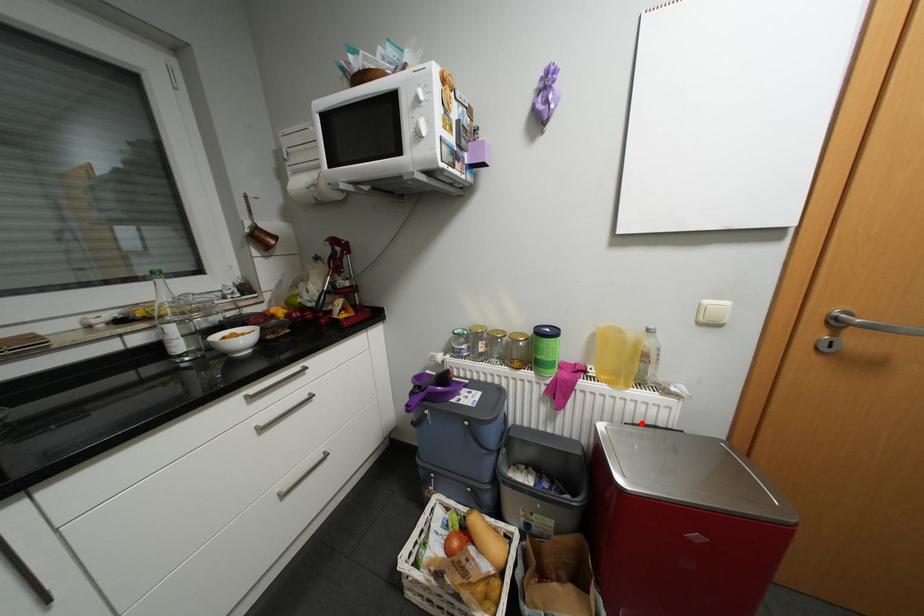
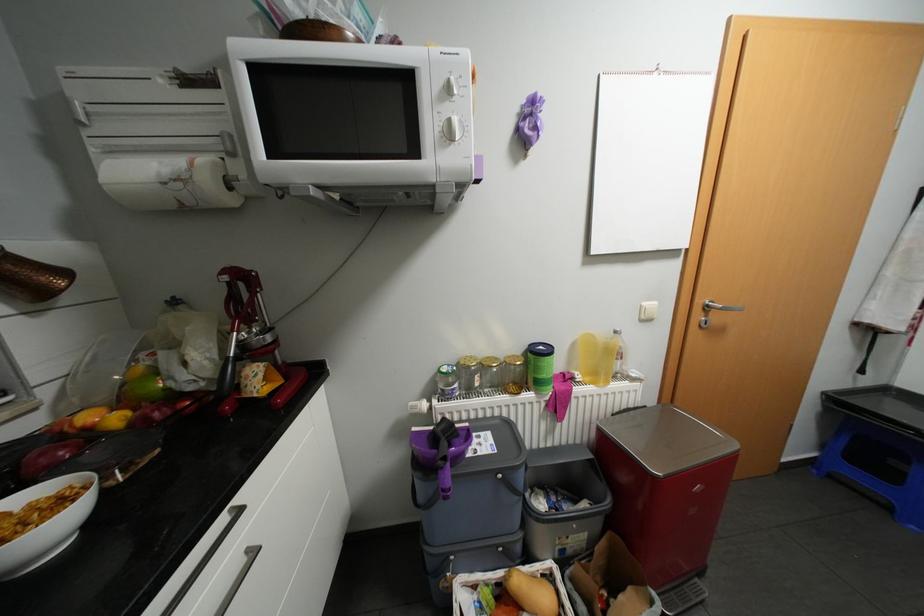
In the second image, find the point that corresponds to the highlighted location in the first image.

(626, 411)